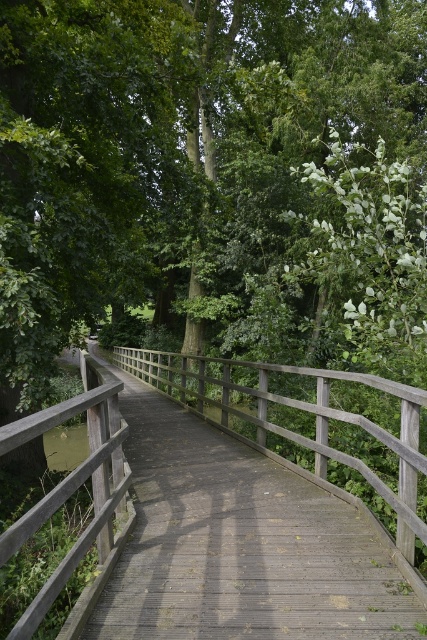
Question: Which of the following is the farthest from the observer?

Choices:
 (A) (114, 435)
 (B) (339, 534)

Answer: (B)

Question: Does wooden bridge at center appear under wooden rail at left?

Choices:
 (A) no
 (B) yes

Answer: (B)

Question: Can you confirm if wooden bridge at center is positioned below wooden rail at left?

Choices:
 (A) yes
 (B) no

Answer: (A)

Question: Is wooden bridge at center thinner than wooden rail at left?

Choices:
 (A) no
 (B) yes

Answer: (A)